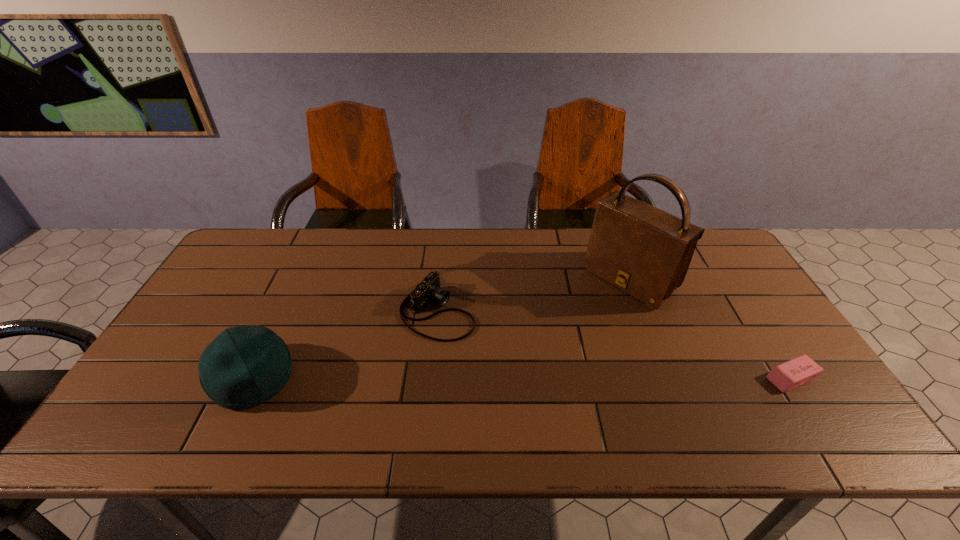
I want to click on the leftmost object, so click(245, 366).

What are the coordinates of `the second tallest object` in the screenshot? It's located at (245, 366).

You are a GUI agent. You are given a task and a screenshot of the screen. Output one action in this format:
    pyautogui.click(x=<x>, y=<y>)
    Task: Click on the eraser
    The height and width of the screenshot is (540, 960).
    Given the screenshot: What is the action you would take?
    pyautogui.click(x=794, y=373)

Where is `the shortest object`? The image size is (960, 540). the shortest object is located at coordinates (794, 373).

I want to click on the second shortest object, so click(428, 290).

At what (x,y) coordinates should I click in order to perform the action: click on camera. Please return your answer as a coordinate pair (x, y). This screenshot has width=960, height=540. Looking at the image, I should click on (428, 290).

Find the location of a particular element. the third object from left to right is located at coordinates (644, 251).

This screenshot has width=960, height=540. In order to click on the tallest object in this screenshot , I will do `click(644, 251)`.

Where is `vacant space located 0.090m on the left of the leftmost object`? vacant space located 0.090m on the left of the leftmost object is located at coordinates (176, 378).

I want to click on vacant space located 0.300m on the left of the rightmost object, so click(645, 378).